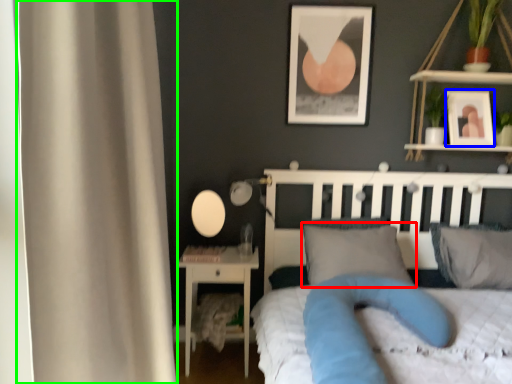
Question: Estimate the real-world distances between objects in this image. Which object is closer to pillow (highlighted by a red box), picture frame (highlighted by a blue box) or curtain (highlighted by a green box)?

Choices:
 (A) picture frame
 (B) curtain

Answer: (A)